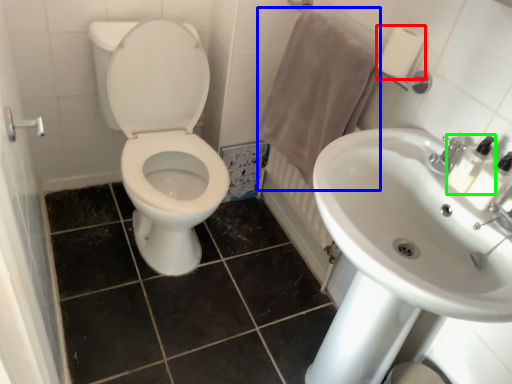
Question: Considering the real-world distances, which object is closest to toilet paper (highlighted by a red box)? bath towel (highlighted by a blue box) or soap dispenser (highlighted by a green box).

Choices:
 (A) bath towel
 (B) soap dispenser

Answer: (A)